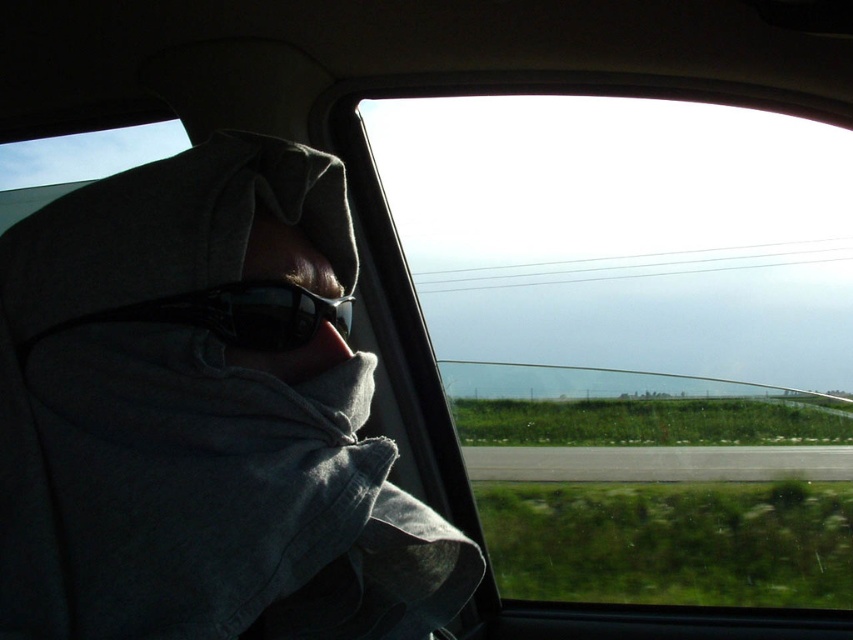
Question: Where is black plastic goggles at left located in relation to matte black sunglasses at center in the image?

Choices:
 (A) below
 (B) above

Answer: (A)

Question: Which point is closer to the camera taking this photo?

Choices:
 (A) (151, 321)
 (B) (218, 326)
 (C) (285, 337)
 (D) (288, 376)

Answer: (A)

Question: Among these points, which one is farthest from the camera?

Choices:
 (A) (345, 300)
 (B) (44, 336)

Answer: (A)

Question: Does black plastic goggles at left have a greater width compared to black reflective sunglasses at center?

Choices:
 (A) no
 (B) yes

Answer: (B)

Question: Is matte black sunglasses at center wider than black reflective sunglasses at center?

Choices:
 (A) no
 (B) yes

Answer: (A)

Question: Which point appears closest to the camera in this image?

Choices:
 (A) pos(498,369)
 (B) pos(221,296)
 (C) pos(254,534)
 (D) pos(167,317)

Answer: (C)